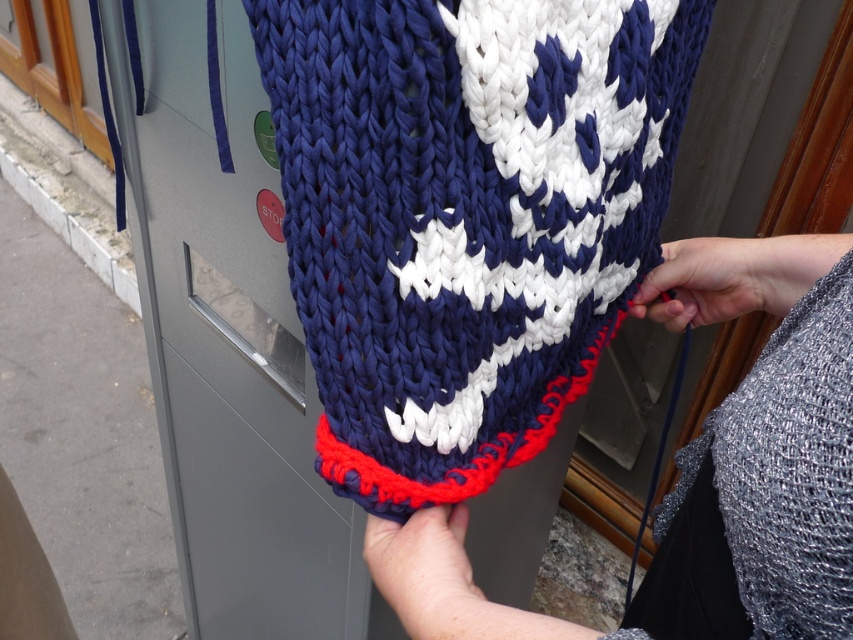
Does white knitted scarf at center appear over smooth gray hand at center right?

Yes.

Is white knitted scarf at center further to camera compared to smooth gray hand at center right?

No, white knitted scarf at center is closer to the viewer.

What do you see at coordinates (445, 582) in the screenshot?
I see `white knitted scarf at center` at bounding box center [445, 582].

The image size is (853, 640). Find the location of `white knitted scarf at center`. white knitted scarf at center is located at coordinates (445, 582).

Locate an element on the screen. smooth skin hand at lower center is located at coordinates (428, 573).

From the picture: Is smooth skin hand at lower center positioned in front of smooth gray hand at center right?

Yes.

Is point (409, 529) closer to viewer compared to point (718, 264)?

That is True.

The image size is (853, 640). In order to click on smooth skin hand at lower center in this screenshot , I will do `click(428, 573)`.

Between white knitted scarf at center and smooth skin hand at lower center, which one appears on the right side from the viewer's perspective?

Positioned to the right is white knitted scarf at center.

This screenshot has height=640, width=853. What are the coordinates of `white knitted scarf at center` in the screenshot? It's located at (445, 582).